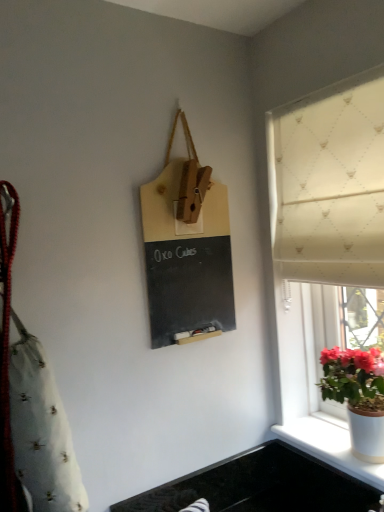
Question: Choose the correct answer: Is matte wood chalkboard at center inside black granite sink at lower center or outside it?

Choices:
 (A) inside
 (B) outside

Answer: (B)

Question: Relative to black granite sink at lower center, is matte wood chalkboard at center in front or behind?

Choices:
 (A) behind
 (B) front

Answer: (B)

Question: Which is nearer to the white glossy pot at window?

Choices:
 (A) black granite sink at lower center
 (B) white ceramic pot at lower right
 (C) white textured fabric at right
 (D) matte wood chalkboard at center

Answer: (B)

Question: Estimate the real-world distances between objects in this image. Which object is farther from the white textured fabric at right?

Choices:
 (A) white glossy pot at window
 (B) matte wood chalkboard at center
 (C) black granite sink at lower center
 (D) white ceramic pot at lower right

Answer: (C)